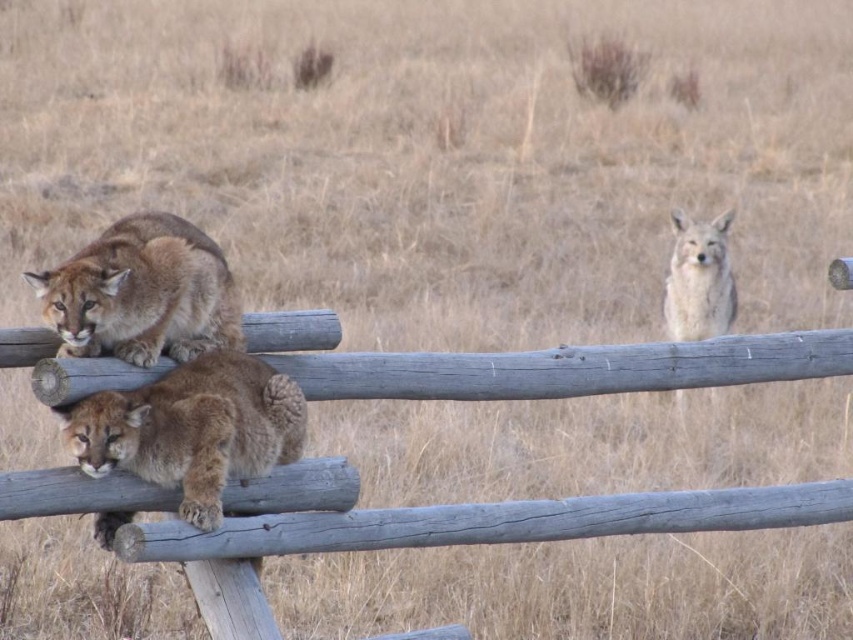
Question: Based on their relative distances, which object is nearer to the brown furry cougar at center?

Choices:
 (A) brown fur cougar at left
 (B) fuzzy beige fox at upper right

Answer: (A)

Question: Can you confirm if brown furry cougar at center is bigger than fuzzy beige fox at upper right?

Choices:
 (A) no
 (B) yes

Answer: (A)

Question: Is brown fur cougar at left smaller than fuzzy beige fox at upper right?

Choices:
 (A) no
 (B) yes

Answer: (B)

Question: Which of the following is the farthest from the observer?

Choices:
 (A) brown furry cougar at center
 (B) fuzzy beige fox at upper right

Answer: (B)

Question: Does brown fur cougar at left appear on the right side of fuzzy beige fox at upper right?

Choices:
 (A) yes
 (B) no

Answer: (B)

Question: Which object is the farthest from the brown fur cougar at left?

Choices:
 (A) fuzzy beige fox at upper right
 (B) brown furry cougar at center

Answer: (A)